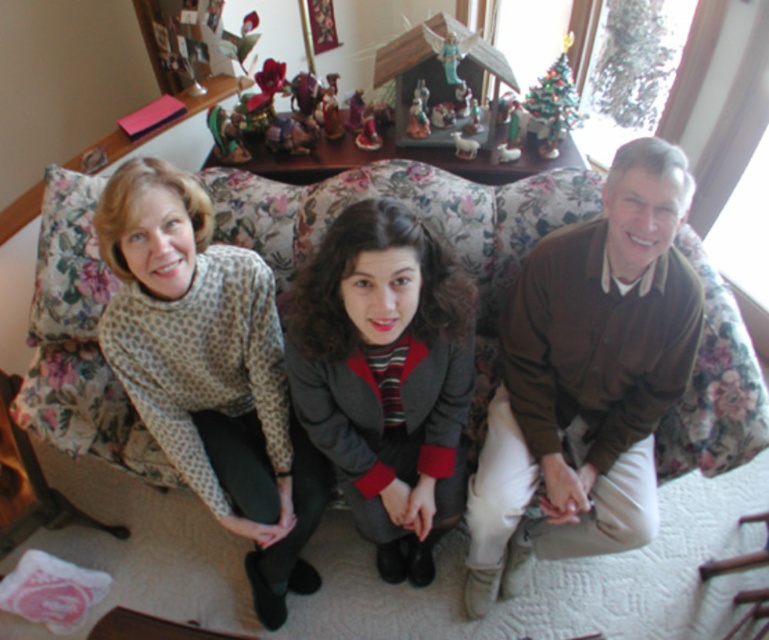
You are a photographer setting up for a group photo. You need to ensure that the brown cotton shirt at right and the printed sweater at left are both visible in the frame. Based on their heights, which clothing item might require you to adjust the camera angle to ensure it doesn not get cropped?

The brown cotton shirt at right is taller than the printed sweater at left, so you might need to adjust the camera angle to accommodate its height to prevent cropping.

You are standing in the room and see the printed sweater at left located at point (210, 371). Can you tell me what is at that coordinate?

The printed sweater at left is located at point (210, 371).

Consider the image. You are arranging a photo shoot and need to ensure that the brown cotton shirt at right and the printed sweater at left are visible in the frame. Based on their positions, which clothing item is higher up in the image?

The brown cotton shirt at right is above the printed sweater at left in the image.